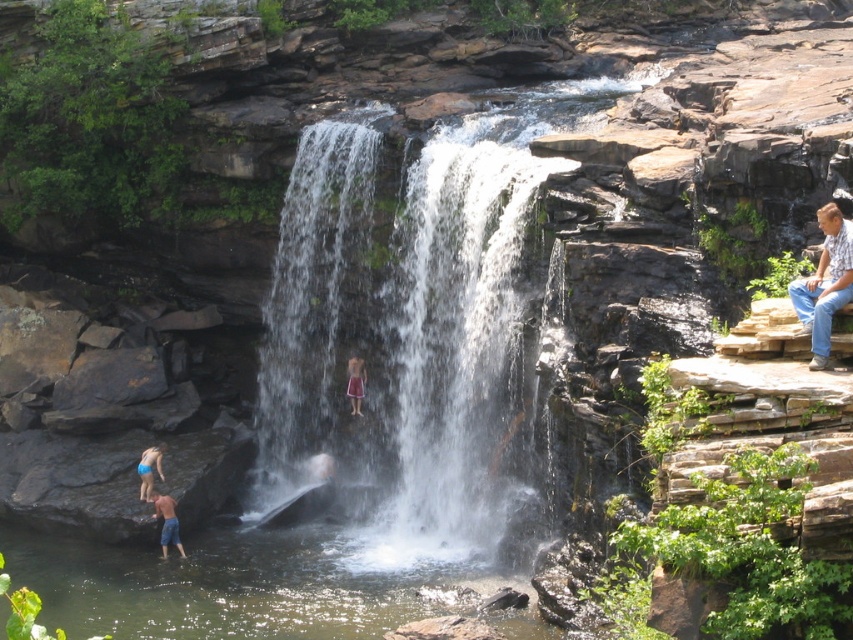
Between clear water at center and reddish-brown fabric shorts at center, which one has more height?

clear water at center

Can you confirm if clear water at center is positioned below reddish-brown fabric shorts at center?

No.

Is point (428, 253) closer to camera compared to point (354, 362)?

Yes, point (428, 253) is in front of point (354, 362).

Locate an element on the screen. clear water at center is located at coordinates (408, 332).

Is clear water at center positioned at the back of blue denim shorts at lower left?

No, clear water at center is in front of blue denim shorts at lower left.

Which is behind, point (460, 141) or point (161, 532)?

Point (460, 141)

You are a GUI agent. You are given a task and a screenshot of the screen. Output one action in this format:
    pyautogui.click(x=<x>, y=<y>)
    Task: Click on the clear water at center
    This screenshot has width=853, height=640.
    Given the screenshot: What is the action you would take?
    point(408,332)

From the picture: Between blue jeans at right and blue denim shorts at lower left, which one has more height?

blue jeans at right

Is blue jeans at right taller than blue denim shorts at lower left?

Yes.

Is point (801, 278) positioned before point (165, 497)?

Yes, it is in front of point (165, 497).

Image resolution: width=853 pixels, height=640 pixels. Find the location of `blue jeans at right`. blue jeans at right is located at coordinates (824, 284).